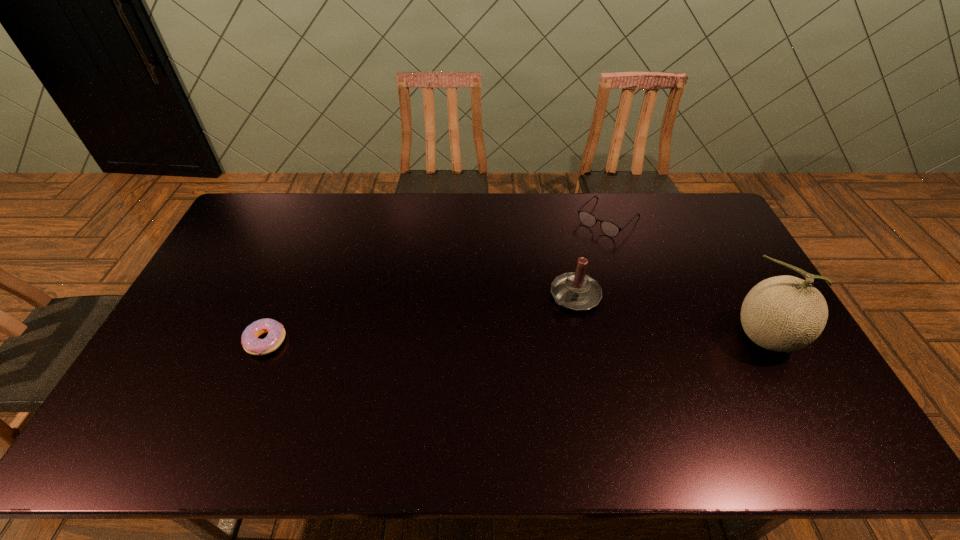
Identify the location of vacant region located 0.140m on the front-facing side of the farthest object. The image size is (960, 540). (571, 258).

Locate an element on the screen. This screenshot has height=540, width=960. free space located 0.170m on the front-facing side of the farthest object is located at coordinates (566, 262).

This screenshot has width=960, height=540. I want to click on vacant space situated on the side of the third shortest object with the handle loop, so click(502, 353).

What are the coordinates of `free location located 0.330m on the side of the third shortest object with the handle loop` in the screenshot? It's located at (478, 373).

At what (x,y) coordinates should I click in order to perform the action: click on free space located on the side of the third shortest object with the handle loop. Please return your answer as a coordinate pair (x, y). The width and height of the screenshot is (960, 540). Looking at the image, I should click on [502, 353].

At what (x,y) coordinates should I click in order to perform the action: click on object situated at the far edge. Please return your answer as a coordinate pair (x, y). Looking at the image, I should click on (610, 229).

Identify the location of object that is at the right edge. Image resolution: width=960 pixels, height=540 pixels. (784, 313).

I want to click on free spot at the far edge of the desktop, so click(x=467, y=217).

The height and width of the screenshot is (540, 960). Find the location of `vacant space at the near edge of the desktop`. vacant space at the near edge of the desktop is located at coordinates (659, 402).

In the image, there is a desktop. Where is `vacant space at the left edge`? This screenshot has width=960, height=540. vacant space at the left edge is located at coordinates (220, 282).